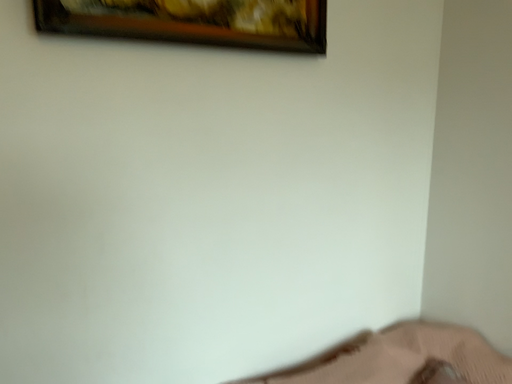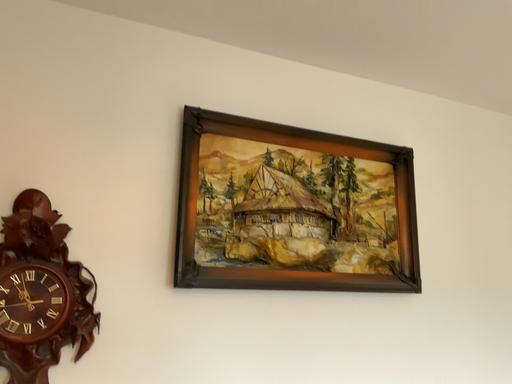
Question: Which way did the camera rotate in the video?

Choices:
 (A) rotated left
 (B) rotated right

Answer: (A)